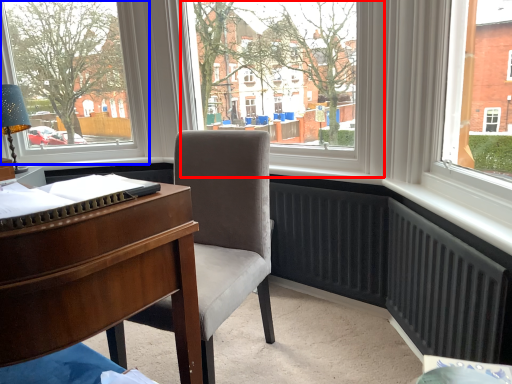
Question: Among these objects, which one is nearest to the camera, window screen (highlighted by a red box) or window (highlighted by a blue box)?

Choices:
 (A) window screen
 (B) window

Answer: (A)